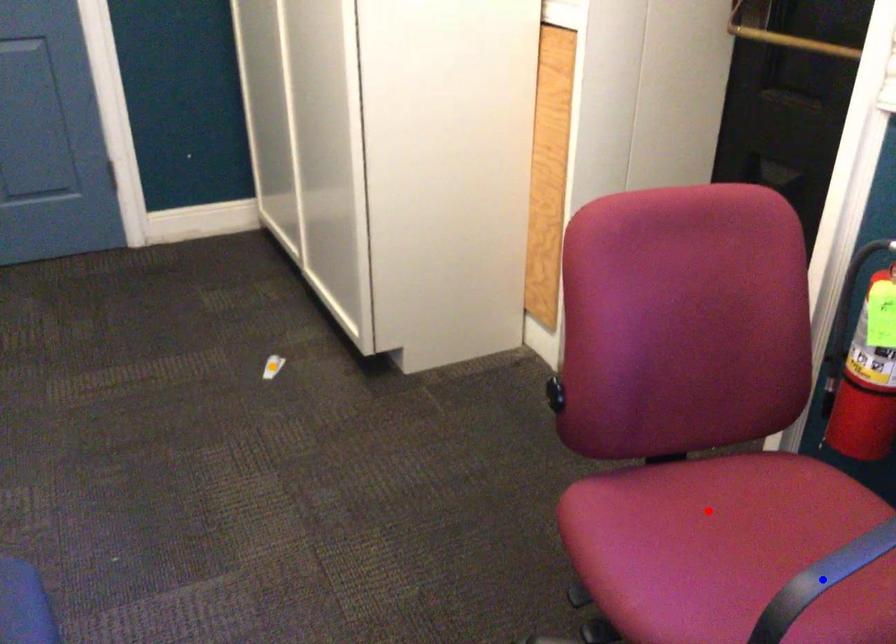
Order these from nearest to farthest:
red point | blue point | orange point

orange point, red point, blue point